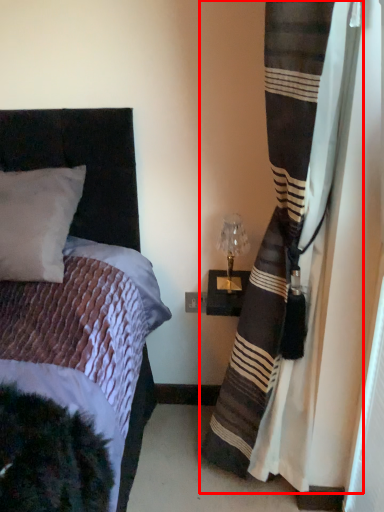
Question: In this image, where is curtain (annotated by the red box) located relative to table lamp?

Choices:
 (A) right
 (B) left

Answer: (A)